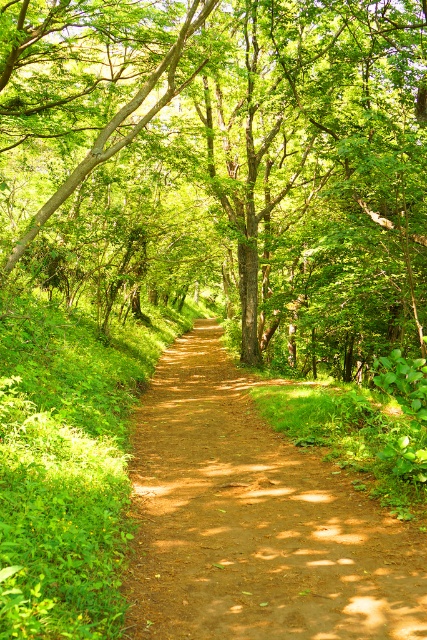
Who is taller, green leafy tree at center or dirt path at center?

With more height is green leafy tree at center.

Does green leafy tree at center appear under dirt path at center?

Actually, green leafy tree at center is above dirt path at center.

Locate an element on the screen. This screenshot has height=640, width=427. green leafy tree at center is located at coordinates (224, 166).